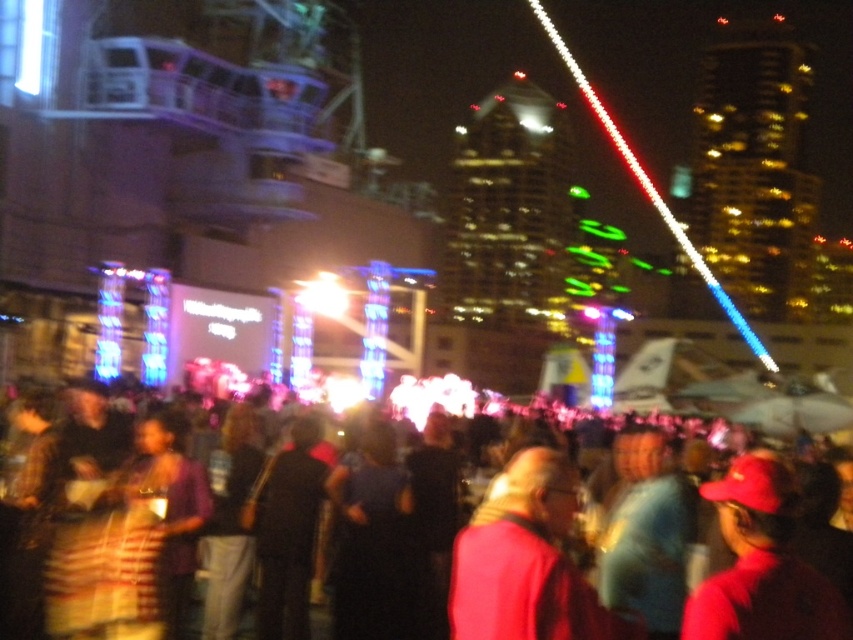
Is point (612, 612) in front of point (10, 618)?

Yes, it is.

What do you see at coordinates (526, 561) in the screenshot? The height and width of the screenshot is (640, 853). I see `pink fabric at center` at bounding box center [526, 561].

Locate an element on the screen. pink fabric at center is located at coordinates (526, 561).

Identify the location of pink fabric at center. This screenshot has width=853, height=640. (526, 561).

Can you confirm if pink fabric at center is wider than red matte cap at lower right?

Yes, pink fabric at center is wider than red matte cap at lower right.

The height and width of the screenshot is (640, 853). Describe the element at coordinates (526, 561) in the screenshot. I see `pink fabric at center` at that location.

Where is `pink fabric at center`? pink fabric at center is located at coordinates (526, 561).

The width and height of the screenshot is (853, 640). I want to click on pink fabric at center, so click(526, 561).

In the scene shown: Who is positioned more to the right, red fabric crowd at center or red matte cap at lower right?

red matte cap at lower right is more to the right.

Consider the image. Which of these two, red fabric crowd at center or red matte cap at lower right, stands shorter?

red matte cap at lower right is shorter.

Where is `red fabric crowd at center`? red fabric crowd at center is located at coordinates (660, 556).

Locate an element on the screen. red fabric crowd at center is located at coordinates (660, 556).